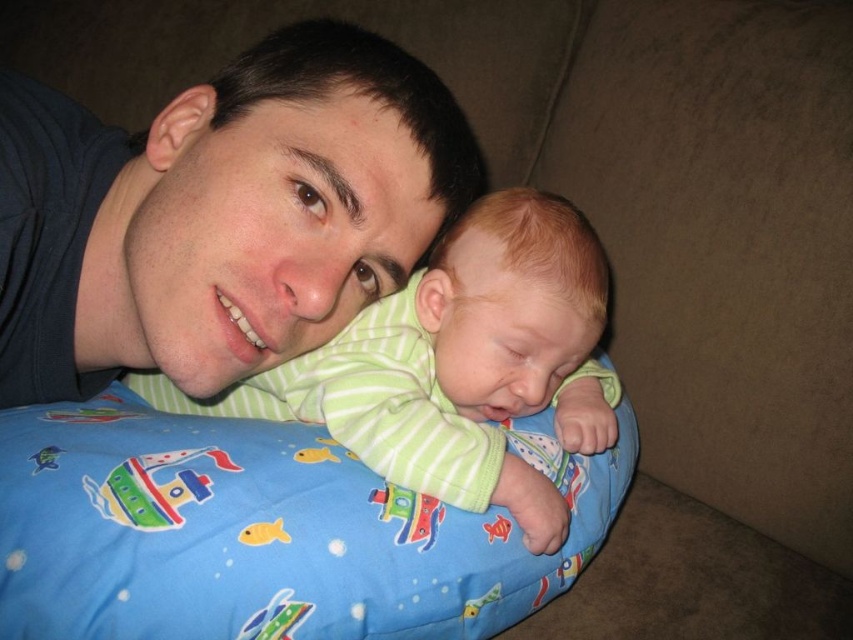
Question: Does matte blue shirt at upper left have a smaller size compared to multicolored fabric boat at lower left?

Choices:
 (A) no
 (B) yes

Answer: (A)

Question: Considering the relative positions of matte blue shirt at upper left and multicolored fabric boat at lower left in the image provided, where is matte blue shirt at upper left located with respect to multicolored fabric boat at lower left?

Choices:
 (A) left
 (B) right

Answer: (A)

Question: Which of the following is the farthest from the observer?

Choices:
 (A) (279, 150)
 (B) (97, 506)
 (C) (111, 589)
 (D) (527, 365)

Answer: (D)

Question: Based on their relative distances, which object is farther from the blue fabric bean bag at center?

Choices:
 (A) matte blue shirt at upper left
 (B) multicolored fabric boat at lower left
 (C) green striped shirt at center

Answer: (A)

Question: Which object is positioned farthest from the green striped shirt at center?

Choices:
 (A) multicolored fabric boat at lower left
 (B) blue fabric bean bag at center

Answer: (A)

Question: Can you confirm if matte blue shirt at upper left is thinner than green striped shirt at center?

Choices:
 (A) no
 (B) yes

Answer: (A)